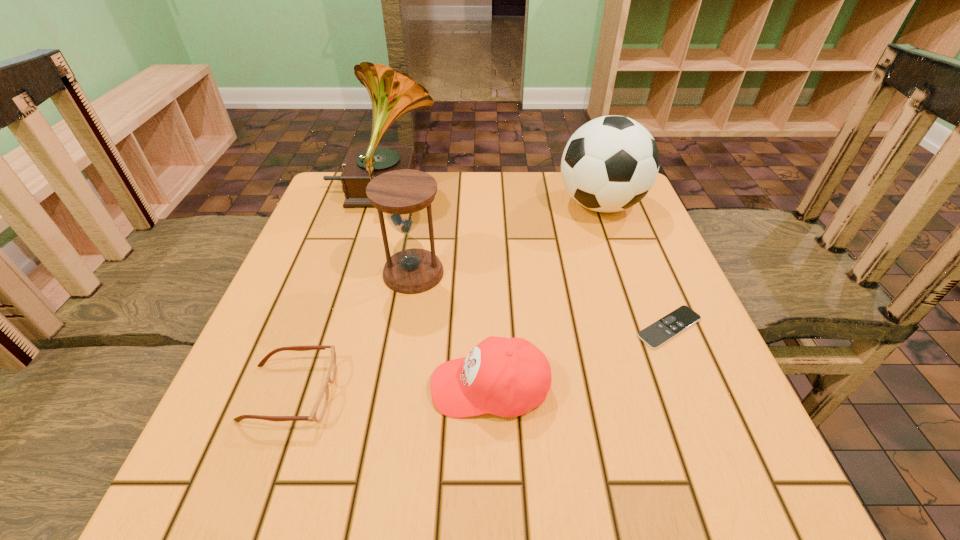
Where is `object that is the third closest to the phonograph record`? object that is the third closest to the phonograph record is located at coordinates (507, 377).

Identify the location of free space that satisfies the following two spatial constraints: 1. from the horn of the tallest object; 2. on the left side of the third farthest object. (358, 273).

This screenshot has width=960, height=540. I want to click on free space that satisfies the following two spatial constraints: 1. from the horn of the phonograph record; 2. on the left side of the fourth nearest object, so click(x=358, y=273).

You are a GUI agent. You are given a task and a screenshot of the screen. Output one action in this format:
    pyautogui.click(x=<x>, y=<y>)
    Task: Click on the free space that satisfies the following two spatial constraints: 1. from the horn of the phonograph record; 2. on the back side of the hourglass
    
    Given the screenshot: What is the action you would take?
    pyautogui.click(x=358, y=273)